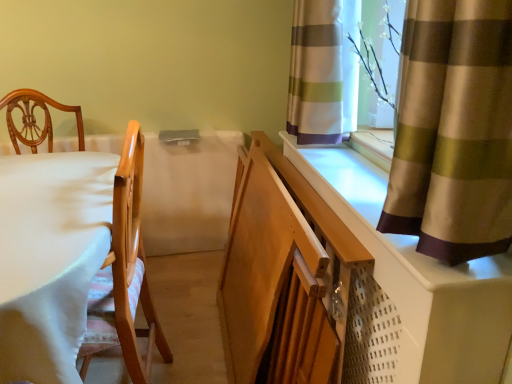
Question: From the image's perspective, is striped fabric curtain at upper right, the first curtain in the back-to-front sequence, positioned above or below silky brown curtain at upper right, arranged as the second curtain when viewed from the back?

Choices:
 (A) above
 (B) below

Answer: (A)

Question: From a real-world perspective, relative to silky brown curtain at upper right, which is counted as the 1th curtain, starting from the front, is striped fabric curtain at upper right, the 2th curtain in the front-to-back sequence, vertically above or below?

Choices:
 (A) below
 (B) above

Answer: (B)

Question: Which object is the closest to the white plastic radiator at right?

Choices:
 (A) silky brown curtain at upper right, which is counted as the 1th curtain, starting from the front
 (B) striped fabric curtain at upper right, the first curtain in the back-to-front sequence
 (C) white fabric table at left

Answer: (A)

Question: Considering the real-world distances, which object is closest to the silky brown curtain at upper right, which is counted as the 1th curtain, starting from the front?

Choices:
 (A) white plastic radiator at right
 (B) white fabric table at left
 (C) striped fabric curtain at upper right, the 2th curtain in the front-to-back sequence

Answer: (A)